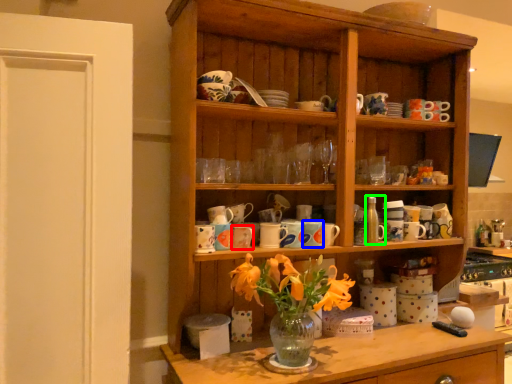
Question: Which object is the closest to the tableware (highlighted by a red box)? Choose among these: tableware (highlighted by a blue box) or bottle (highlighted by a green box).

Choices:
 (A) tableware
 (B) bottle

Answer: (A)